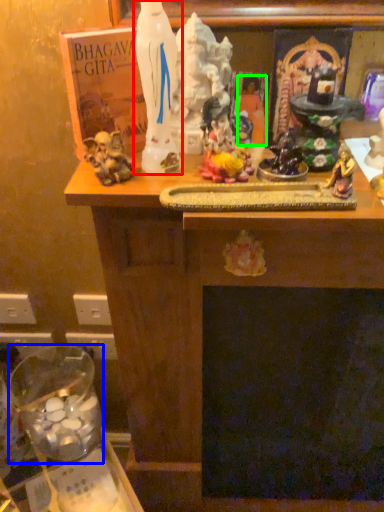
Question: Which object is the closest to the statue (highlighted by a red box)? Choose among these: glass jar (highlighted by a blue box) or person (highlighted by a green box).

Choices:
 (A) glass jar
 (B) person

Answer: (B)